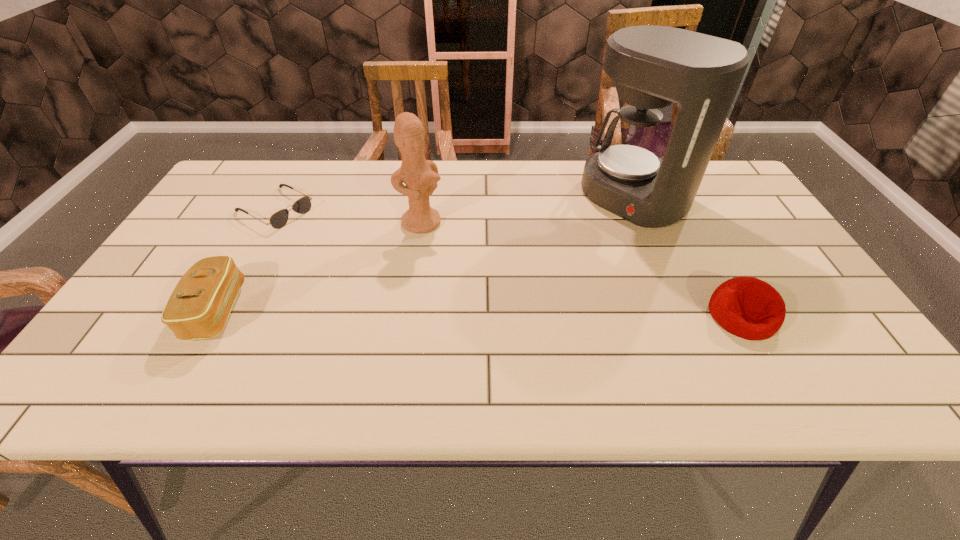
At what (x,y) coordinates should I click in order to perform the action: click on free space at the near left corner of the desktop. Please return your answer as a coordinate pair (x, y). This screenshot has height=540, width=960. Looking at the image, I should click on (145, 326).

At what (x,y) coordinates should I click in order to perform the action: click on free location at the near right corner of the desktop. Please return your answer as a coordinate pair (x, y). Looking at the image, I should click on (828, 333).

Identify the location of empty location between the third object from left to right and the coffee maker. (528, 211).

You are a GUI agent. You are given a task and a screenshot of the screen. Output one action in this format:
    pyautogui.click(x=<x>, y=<y>)
    Task: Click on the empty space that is in between the tallest object and the beanbag
    This screenshot has height=540, width=960.
    Given the screenshot: What is the action you would take?
    click(x=688, y=256)

You are a GUI agent. You are given a task and a screenshot of the screen. Output one action in this format:
    pyautogui.click(x=<x>, y=<y>)
    Task: Click on the vacant space that's between the beanbag and the sunglasses
    The width and height of the screenshot is (960, 540).
    Given the screenshot: What is the action you would take?
    509,262

This screenshot has width=960, height=540. I want to click on vacant area between the sunglasses and the clutch bag, so click(x=246, y=260).

Identify the location of free space between the coffee maker and the second tallest object. The height and width of the screenshot is (540, 960). (528, 211).

The width and height of the screenshot is (960, 540). I want to click on vacant space in between the figurine and the clutch bag, so point(319,267).

Locate an element on the screen. empty space between the beanbag and the third object from right to left is located at coordinates (582, 269).

Find the location of `empty space that is in between the beanbag and the tallest object`. empty space that is in between the beanbag and the tallest object is located at coordinates (688, 256).